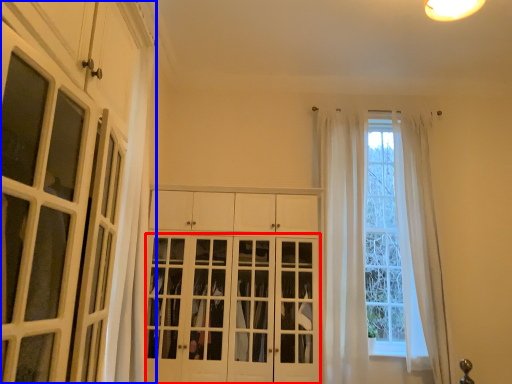
Question: Which point is closer to the camera, door (highlighted by a red box) or cabinetry (highlighted by a blue box)?

Choices:
 (A) door
 (B) cabinetry

Answer: (B)